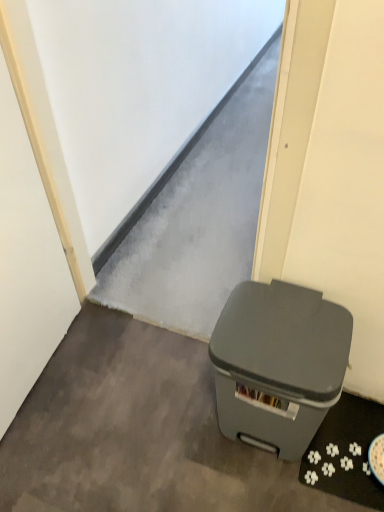
Question: From a real-world perspective, is matte gray plastic trash can at lower right physically located above or below gray matte trash can at lower right?

Choices:
 (A) below
 (B) above

Answer: (B)

Question: Is matte gray plastic trash can at lower right inside the boundaries of gray matte trash can at lower right, or outside?

Choices:
 (A) outside
 (B) inside

Answer: (A)

Question: From the image's perspective, is matte gray plastic trash can at lower right above or below gray matte trash can at lower right?

Choices:
 (A) below
 (B) above

Answer: (B)

Question: Considering the positions of point (236, 448) and point (236, 431), is point (236, 448) closer or farther from the camera than point (236, 431)?

Choices:
 (A) closer
 (B) farther

Answer: (B)

Question: Is gray matte trash can at lower right wider or thinner than matte gray plastic trash can at lower right?

Choices:
 (A) wide
 (B) thin

Answer: (A)

Question: From a real-world perspective, is gray matte trash can at lower right positioned above or below matte gray plastic trash can at lower right?

Choices:
 (A) below
 (B) above

Answer: (A)

Question: Is gray matte trash can at lower right to the left or to the right of matte gray plastic trash can at lower right in the image?

Choices:
 (A) left
 (B) right

Answer: (A)